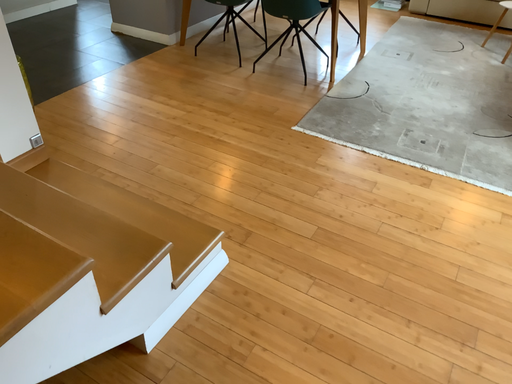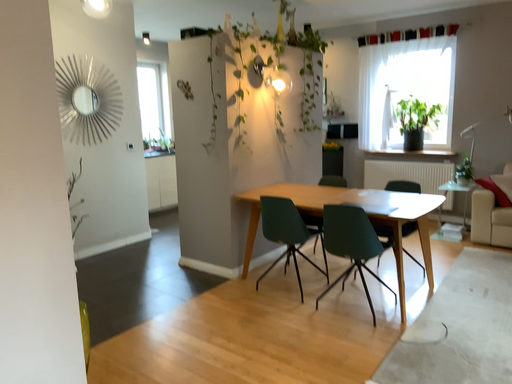
Question: Which way did the camera rotate in the video?

Choices:
 (A) rotated left
 (B) rotated right

Answer: (A)